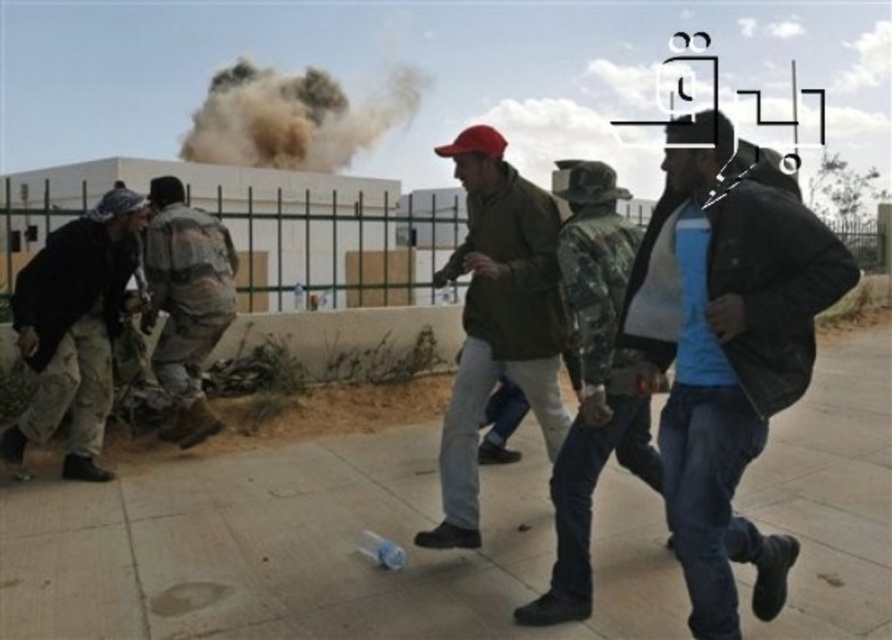
Who is shorter, smooth concrete pavement at center or blue denim jeans at center?

smooth concrete pavement at center is shorter.

Between smooth concrete pavement at center and blue denim jeans at center, which one is positioned higher?

blue denim jeans at center is higher up.

This screenshot has width=892, height=640. What do you see at coordinates (316, 548) in the screenshot?
I see `smooth concrete pavement at center` at bounding box center [316, 548].

Where is `smooth concrete pavement at center`? This screenshot has width=892, height=640. smooth concrete pavement at center is located at coordinates (316, 548).

Is point (641, 236) closer to viewer compared to point (190, 240)?

Yes, point (641, 236) is closer to viewer.

Does camouflage jacket at center have a greater height compared to camouflage uniform at center?

Correct, camouflage jacket at center is much taller as camouflage uniform at center.

Who is more distant from viewer, (612, 310) or (172, 192)?

Positioned behind is point (172, 192).

Find the location of `camouflage jacket at center`. camouflage jacket at center is located at coordinates (592, 384).

Between blue denim jeans at center and camouflage uniform at center, which one is positioned lower?

blue denim jeans at center is lower down.

Between blue denim jeans at center and camouflage uniform at center, which one appears on the left side from the viewer's perspective?

From the viewer's perspective, camouflage uniform at center appears more on the left side.

Which is in front, point (783, 230) or point (174, 417)?

Point (783, 230) is in front.

Identify the location of blue denim jeans at center. (725, 349).